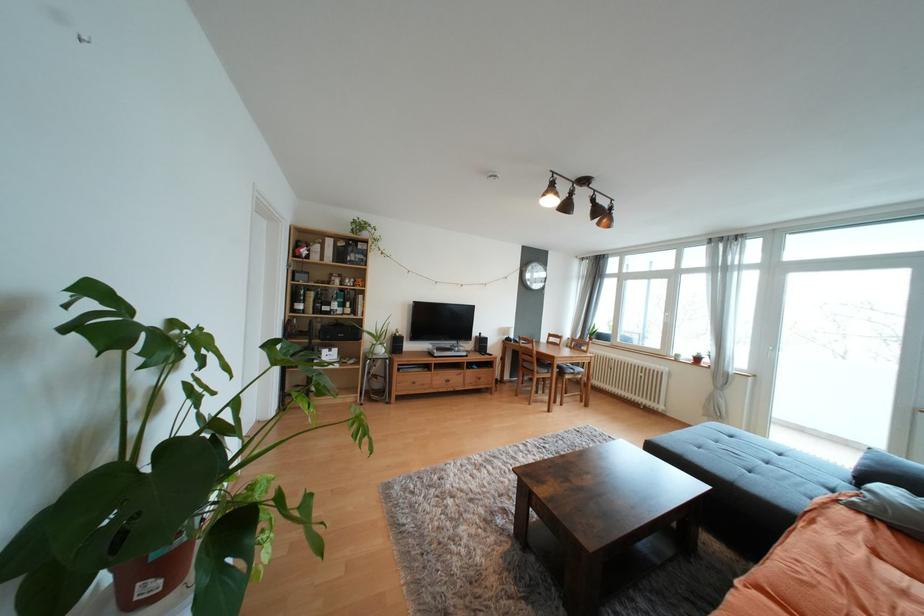
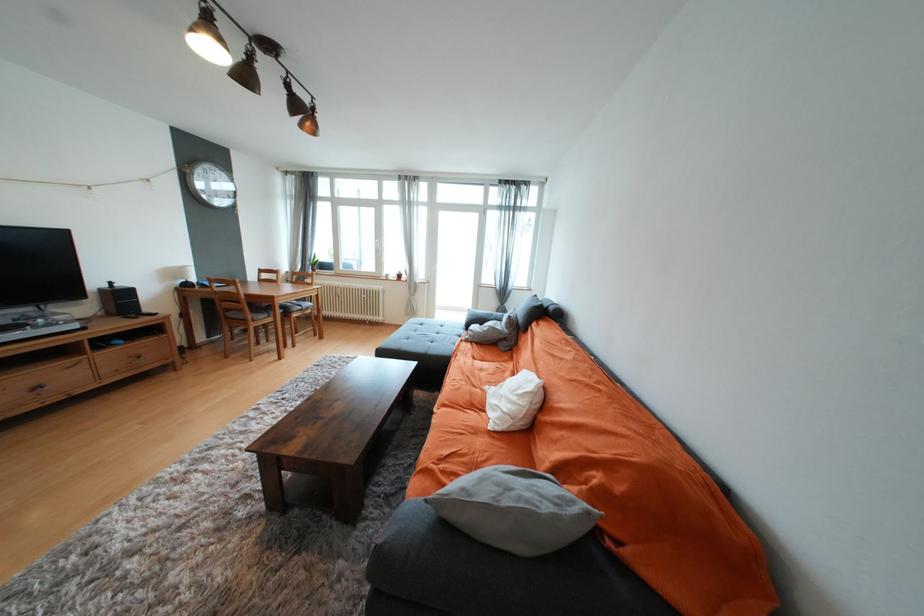
The point at (494, 353) is marked in the first image. Where is the corresponding point in the second image?

(152, 312)